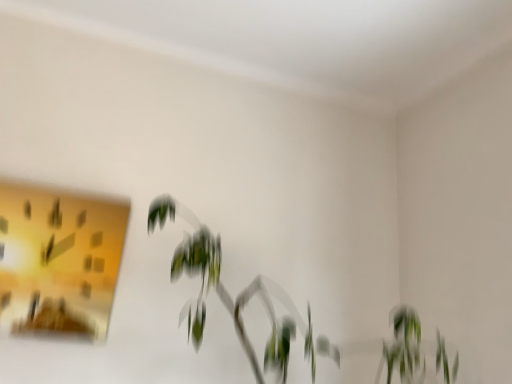
At what (x,y) coordinates should I click in order to perform the action: click on yellow matte clock at upper left. Please return your answer as a coordinate pair (x, y). Looking at the image, I should click on (58, 261).

In order to face yellow matte clock at upper left, should I rotate leftwards or rightwards?

Rotate your view left by about 24.712°.

This screenshot has width=512, height=384. Describe the element at coordinates (58, 261) in the screenshot. I see `yellow matte clock at upper left` at that location.

Identify the location of yellow matte clock at upper left. (58, 261).